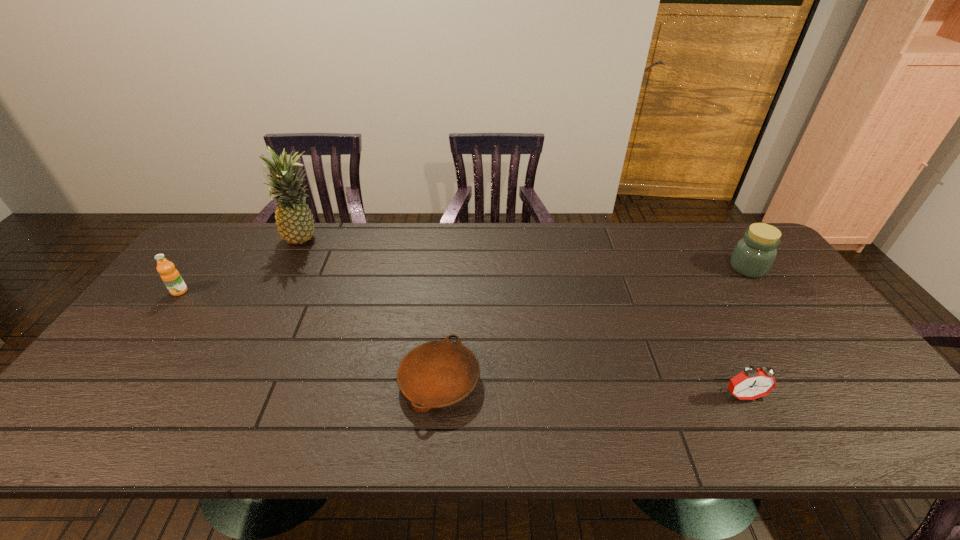
Find the location of a particular element. The width and height of the screenshot is (960, 540). free location that satisfies the following two spatial constraints: 1. on the label of the leftmost object; 2. on the left side of the plate is located at coordinates (112, 381).